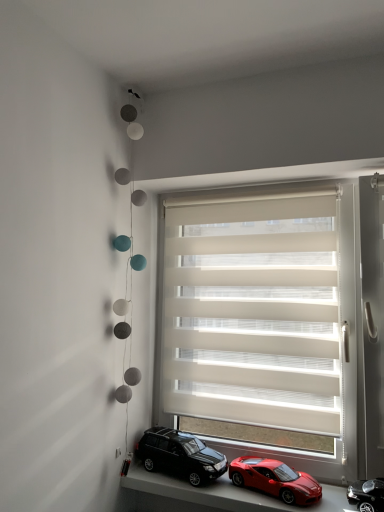
Question: Is shiny black suv at lower center, placed as the 3th car when sorted from right to left, inside smooth plastic toy cars at lower center?

Choices:
 (A) yes
 (B) no

Answer: (B)

Question: Is smooth plastic toy cars at lower center in contact with shiny black suv at lower center, placed as the 3th car when sorted from right to left?

Choices:
 (A) no
 (B) yes

Answer: (B)

Question: From the image's perspective, would you say smooth plastic toy cars at lower center is positioned over shiny black suv at lower center, placed as the 3th car when sorted from right to left?

Choices:
 (A) yes
 (B) no

Answer: (B)

Question: From the image's perspective, is smooth plastic toy cars at lower center beneath shiny black suv at lower center, the first car in the left-to-right sequence?

Choices:
 (A) yes
 (B) no

Answer: (A)

Question: Considering the relative sizes of smooth plastic toy cars at lower center and shiny black suv at lower center, the first car in the left-to-right sequence, in the image provided, is smooth plastic toy cars at lower center bigger than shiny black suv at lower center, the first car in the left-to-right sequence,?

Choices:
 (A) yes
 (B) no

Answer: (A)

Question: Is smooth plastic toy cars at lower center aimed at shiny black suv at lower center, placed as the 3th car when sorted from right to left?

Choices:
 (A) yes
 (B) no

Answer: (B)

Question: Is shiny red car at lower center, the 2th car in the left-to-right sequence, to the left of shiny black suv at lower center, the first car in the left-to-right sequence, from the viewer's perspective?

Choices:
 (A) yes
 (B) no

Answer: (B)

Question: Is shiny red car at lower center, the 2th car in the left-to-right sequence, next to shiny black suv at lower center, placed as the 3th car when sorted from right to left, and touching it?

Choices:
 (A) yes
 (B) no

Answer: (B)

Question: Is shiny red car at lower center, the second car in the right-to-left sequence, positioned with its back to shiny black suv at lower center, placed as the 3th car when sorted from right to left?

Choices:
 (A) no
 (B) yes

Answer: (A)

Question: Does shiny red car at lower center, the second car in the right-to-left sequence, come in front of shiny black suv at lower center, placed as the 3th car when sorted from right to left?

Choices:
 (A) no
 (B) yes

Answer: (B)

Question: Does shiny red car at lower center, the 2th car in the left-to-right sequence, have a lesser width compared to shiny black suv at lower center, placed as the 3th car when sorted from right to left?

Choices:
 (A) no
 (B) yes

Answer: (B)

Question: Considering the relative sizes of shiny red car at lower center, the second car in the right-to-left sequence, and shiny black suv at lower center, placed as the 3th car when sorted from right to left, in the image provided, is shiny red car at lower center, the second car in the right-to-left sequence, shorter than shiny black suv at lower center, placed as the 3th car when sorted from right to left,?

Choices:
 (A) yes
 (B) no

Answer: (A)

Question: From a real-world perspective, is smooth plastic toy cars at lower center under beige fabric window blind at center?

Choices:
 (A) no
 (B) yes

Answer: (B)